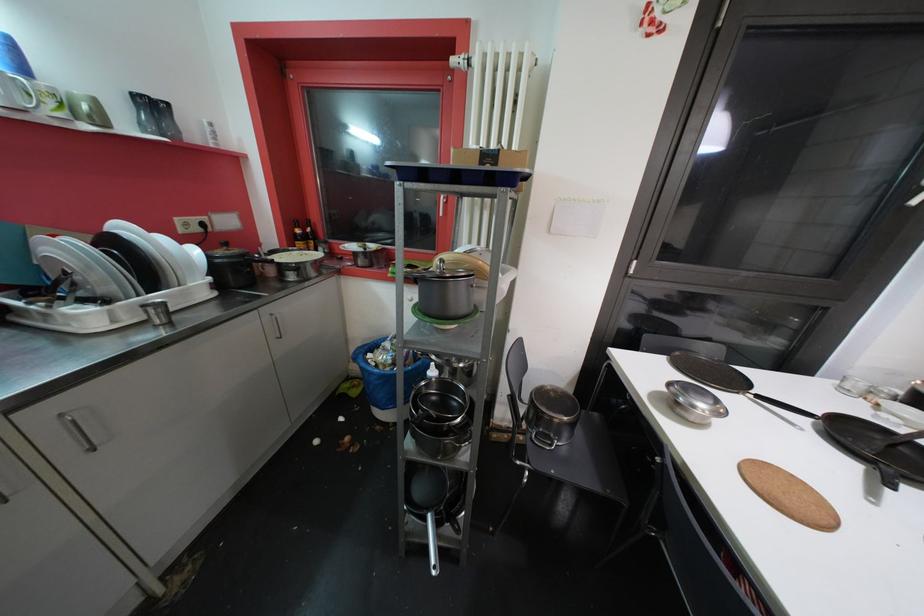
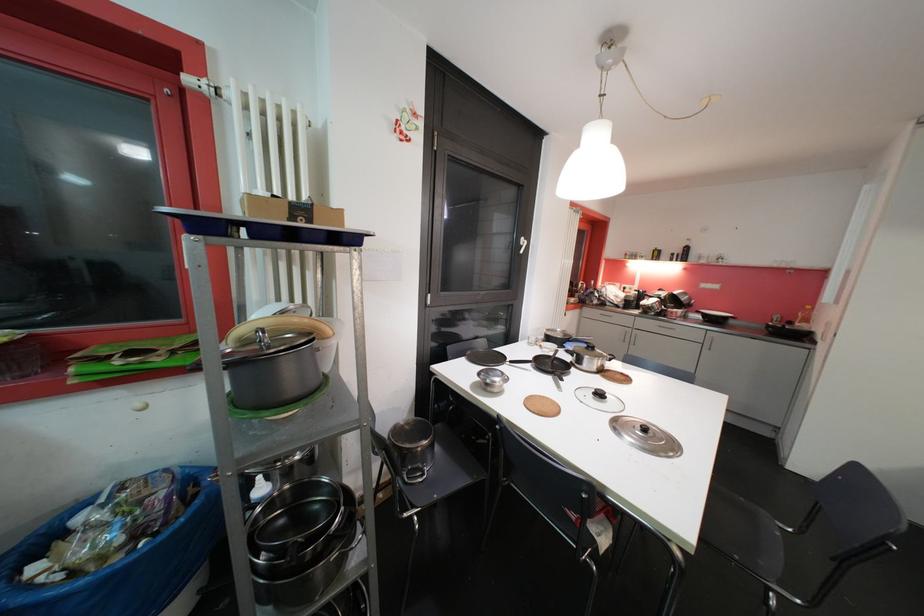
Find the pixel in the second image that matches (577,428) in the first image.

(436, 447)